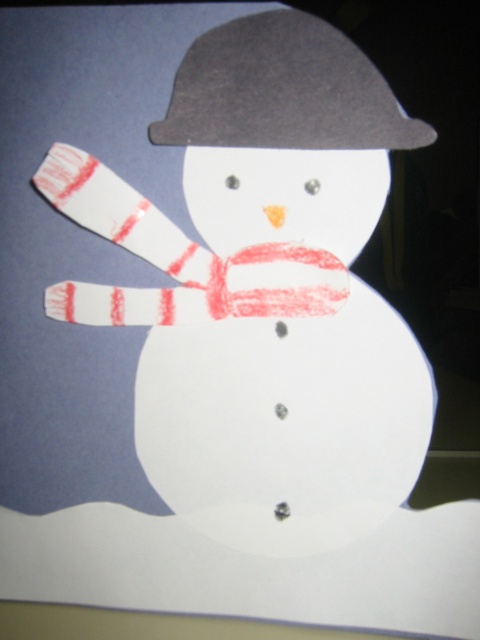
Does white paper snowman at center have a greater height compared to dark gray felt hat at upper center?

Yes, white paper snowman at center is taller than dark gray felt hat at upper center.

Is white paper snowman at center shorter than dark gray felt hat at upper center?

In fact, white paper snowman at center may be taller than dark gray felt hat at upper center.

Which is behind, point (216, 294) or point (261, 125)?

Positioned behind is point (216, 294).

Where is `white paper snowman at center`? white paper snowman at center is located at coordinates (264, 291).